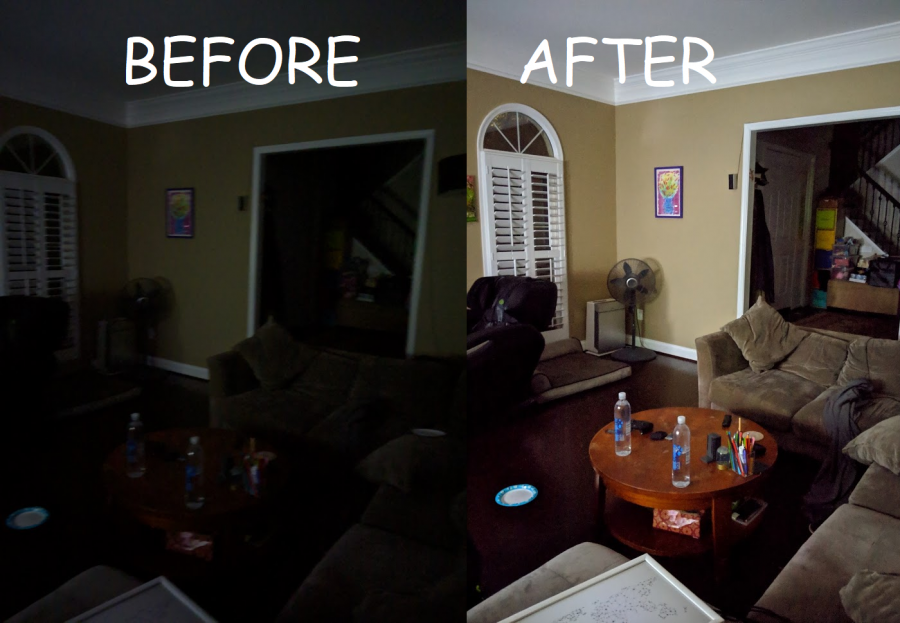
Find the location of a particular element. This screenshot has width=900, height=623. upper window is located at coordinates point(527,130), point(40,150).